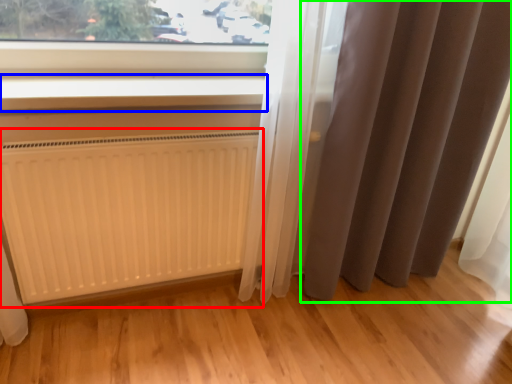
Question: Considering the real-world distances, which object is farthest from radiator (highlighted by a red box)? window sill (highlighted by a blue box) or curtain (highlighted by a green box)?

Choices:
 (A) window sill
 (B) curtain

Answer: (B)